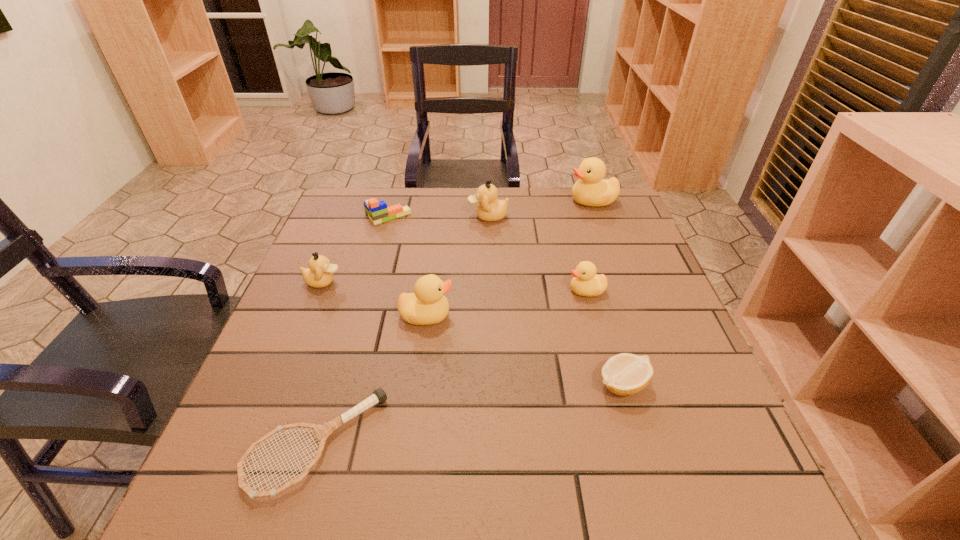
Find the location of a particular element. The image size is (960, 540). the farthest yellow duckling is located at coordinates (591, 190).

Locate an element on the screen. Image resolution: width=960 pixels, height=540 pixels. the right tan duckling is located at coordinates (489, 209).

I want to click on the farther tan duckling, so click(489, 209).

You are a GUI agent. You are given a task and a screenshot of the screen. Output one action in this format:
    pyautogui.click(x=<x>, y=<y>)
    Task: Click on the second biggest yellow duckling
    
    Given the screenshot: What is the action you would take?
    pyautogui.click(x=427, y=305)

The height and width of the screenshot is (540, 960). In order to click on the nearest yellow duckling in this screenshot , I will do `click(427, 305)`.

In order to click on the nearer tan duckling in this screenshot , I will do `click(319, 274)`.

The width and height of the screenshot is (960, 540). What are the coordinates of `the left tan duckling` in the screenshot? It's located at (319, 274).

Where is `the smallest yellow duckling`? the smallest yellow duckling is located at coordinates (585, 282).

This screenshot has width=960, height=540. What are the coordinates of `orange Lego` in the screenshot? It's located at (377, 211).

Locate an element on the screen. The width and height of the screenshot is (960, 540). Lego is located at coordinates (377, 211).